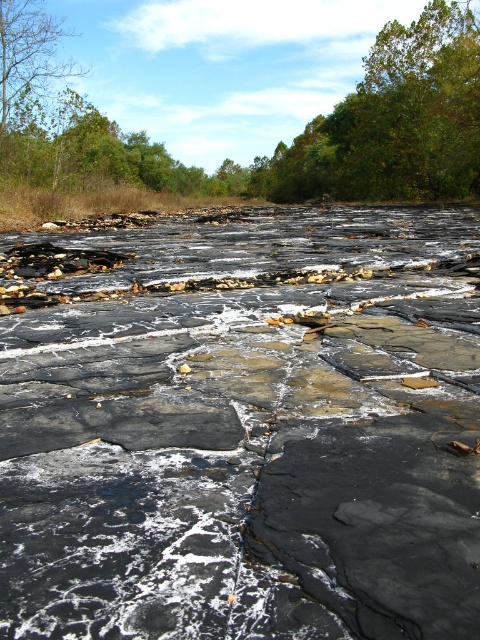
Question: Is black stone creek at center positioned in front of green leafy tree at upper right?

Choices:
 (A) no
 (B) yes

Answer: (B)

Question: Among these objects, which one is nearest to the camera?

Choices:
 (A) green leafy tree at upper center
 (B) green leafy tree at upper right
 (C) brown leafy tree at upper left
 (D) black stone creek at center

Answer: (D)

Question: Which of the following is the closest to the observer?

Choices:
 (A) brown leafy tree at upper left
 (B) green leafy tree at upper right
 (C) black stone creek at center

Answer: (C)

Question: Which point is farther to the camera?

Choices:
 (A) (135, 166)
 (B) (377, 470)

Answer: (A)

Question: Where is green leafy tree at upper right located in relation to brown leafy tree at upper left in the image?

Choices:
 (A) below
 (B) above

Answer: (B)

Question: Does green leafy tree at upper center appear over brown leafy tree at upper left?

Choices:
 (A) yes
 (B) no

Answer: (A)